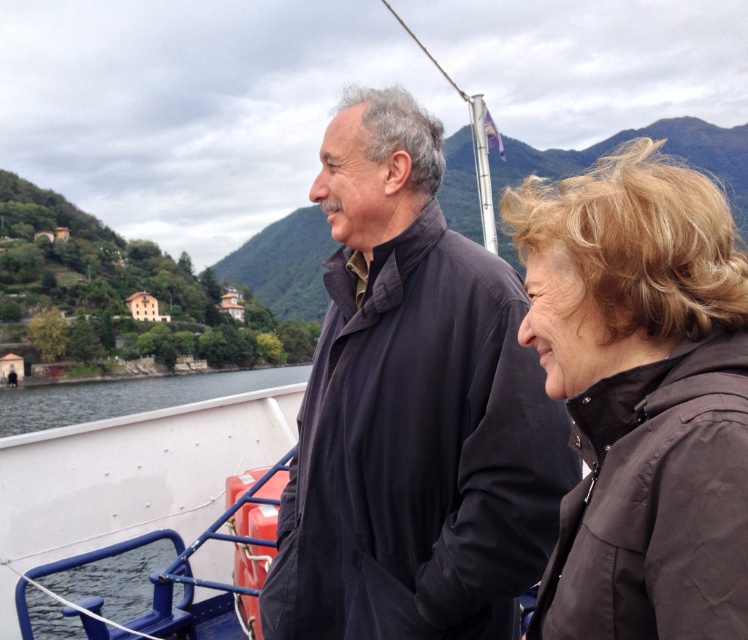
Question: Which point appears closest to the camera in this image?

Choices:
 (A) (22, 532)
 (B) (542, 596)
 (C) (21, 424)
 (D) (453, 481)

Answer: (B)

Question: Observing the image, what is the correct spatial positioning of white matte boat at center in reference to white smooth water at lower left?

Choices:
 (A) below
 (B) above

Answer: (B)

Question: Which object is the farthest from the white smooth water at lower left?

Choices:
 (A) brown matte jacket at right
 (B) dark matte jacket at center
 (C) white matte boat at center

Answer: (A)

Question: From the image, what is the correct spatial relationship of brown matte jacket at right in relation to white matte boat at center?

Choices:
 (A) below
 (B) above

Answer: (B)

Question: Considering the relative positions of brown matte jacket at right and white matte boat at center in the image provided, where is brown matte jacket at right located with respect to white matte boat at center?

Choices:
 (A) right
 (B) left

Answer: (A)

Question: Which object is farther from the camera taking this photo?

Choices:
 (A) dark matte jacket at center
 (B) brown matte jacket at right
 (C) white smooth water at lower left

Answer: (C)